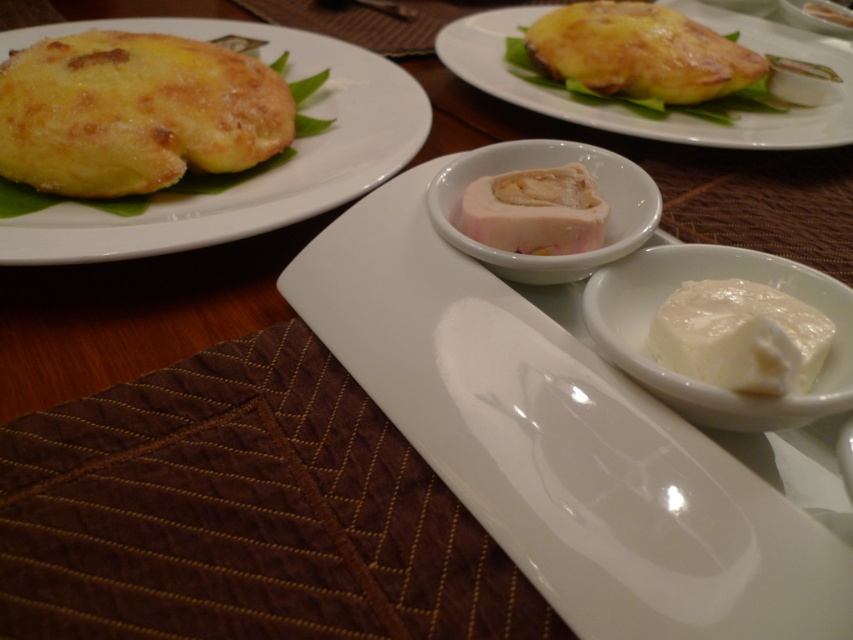
Is the position of yellow cheesy pancake at upper left less distant than that of pink creamy rolled meat at center?

No, it is behind pink creamy rolled meat at center.

This screenshot has width=853, height=640. In order to click on yellow cheesy pancake at upper left in this screenshot , I will do `click(135, 113)`.

Which is behind, point (474, 362) or point (834, 22)?

Point (834, 22)

Can you confirm if white glossy rectangular plate at center is positioned to the right of white creamy sauce at center?

Incorrect, white glossy rectangular plate at center is not on the right side of white creamy sauce at center.

Does point (653, 483) come behind point (833, 12)?

No, it is not.

In order to click on white glossy rectangular plate at center in this screenshot , I will do `click(567, 440)`.

Who is more forward, (461, 445) or (718, 289)?

Positioned in front is point (461, 445).

Which is behind, point (833, 547) or point (769, 332)?

The point (769, 332) is behind.

This screenshot has height=640, width=853. I want to click on white glossy rectangular plate at center, so click(567, 440).